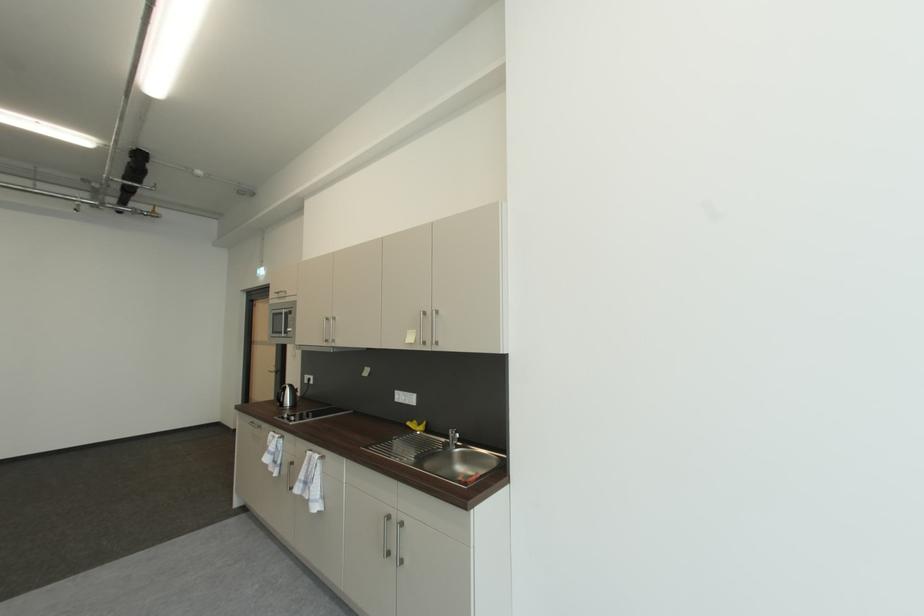
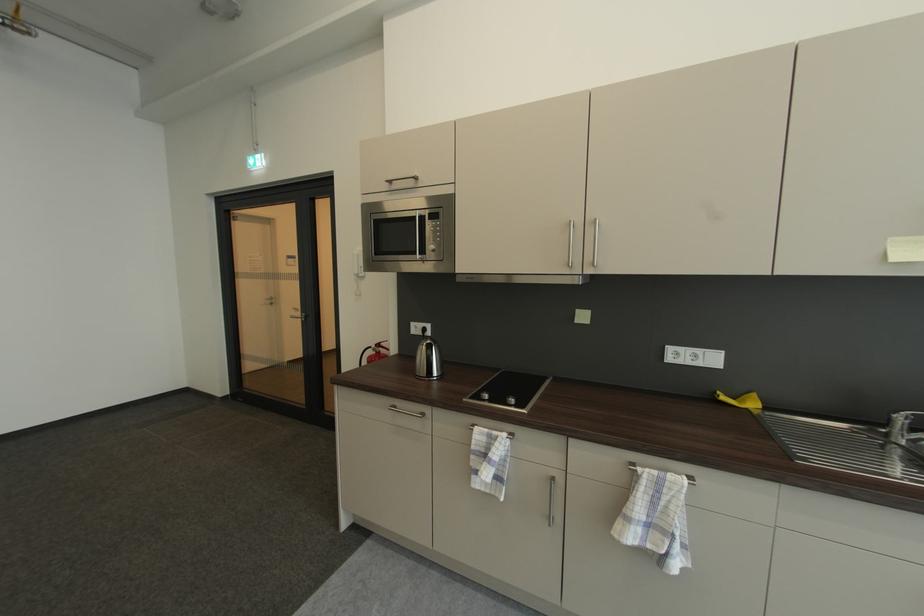
The point at [281,371] is marked in the first image. Where is the corresponding point in the second image?

(305, 315)